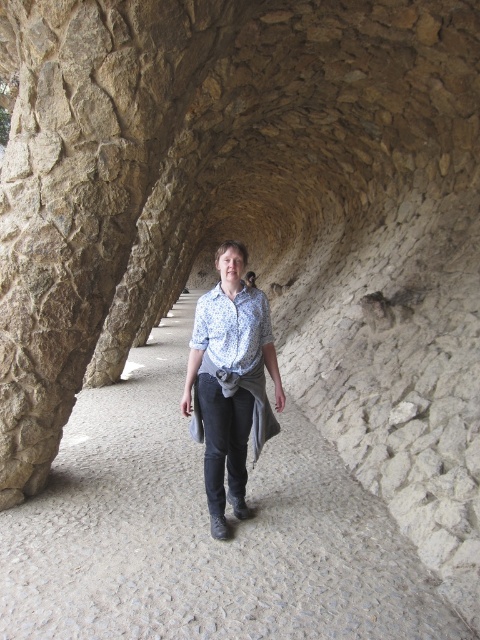
You are standing at the entrance of the stone tunnel and see the gray cobblestone path at center and the blue printed shirt at center. Which object is closer to you?

The gray cobblestone path at center is closer to you because it is in front of the blue printed shirt at center.